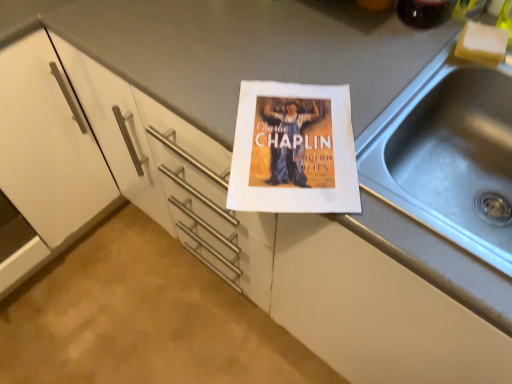
Locate an element on the screen. Image resolution: width=512 pixels, height=384 pixels. free area behind white sponge at upper right is located at coordinates (448, 23).